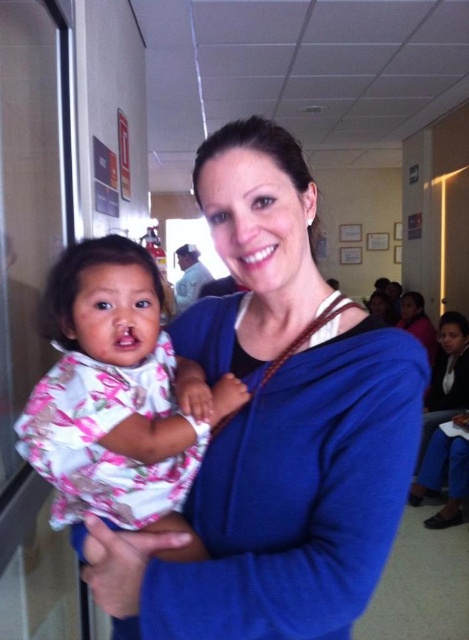
Question: Which of the following is the closest to the observer?

Choices:
 (A) blue zip-up sweater at center
 (B) matte blue sweater at center

Answer: (A)

Question: Which of these objects is positioned closest to the floral fabric baby at left?

Choices:
 (A) blue zip-up sweater at center
 (B) matte blue sweater at center

Answer: (A)

Question: Does floral fabric baby at left appear on the left side of matte blue sweater at center?

Choices:
 (A) no
 (B) yes

Answer: (B)

Question: Which of the following is the closest to the observer?

Choices:
 (A) floral fabric baby at left
 (B) blue zip-up sweater at center

Answer: (B)

Question: Is floral fabric baby at left bigger than matte blue sweater at center?

Choices:
 (A) no
 (B) yes

Answer: (A)

Question: Is blue zip-up sweater at center behind matte blue sweater at center?

Choices:
 (A) no
 (B) yes

Answer: (A)